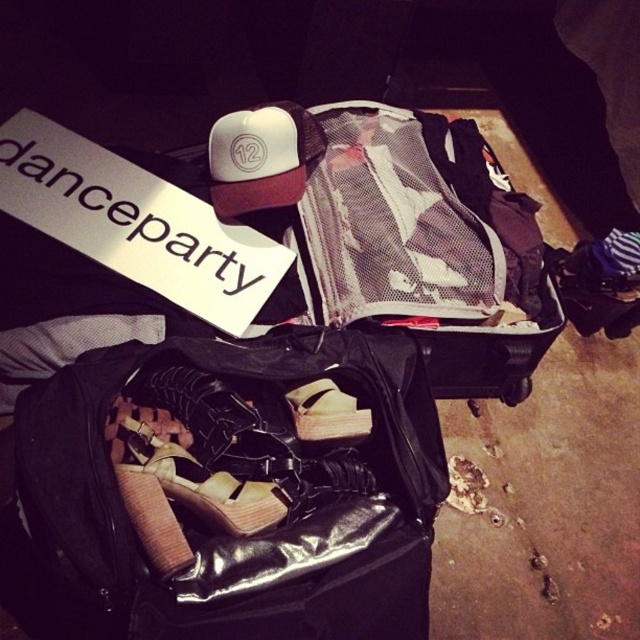
Question: Considering the real-world distances, which object is farthest from the white paper sign at upper left?

Choices:
 (A) matte black suitcase at center
 (B) black shiny fabric suitcase at lower left

Answer: (B)

Question: Does black shiny fabric suitcase at lower left appear on the right side of brown leather shoe at center?

Choices:
 (A) no
 (B) yes

Answer: (A)

Question: Is matte black suitcase at center thinner than brown leather shoe at center?

Choices:
 (A) no
 (B) yes

Answer: (A)

Question: Considering the real-world distances, which object is farthest from the black shiny fabric suitcase at lower left?

Choices:
 (A) white paper sign at upper left
 (B) matte black suitcase at center

Answer: (B)

Question: Does black shiny fabric suitcase at lower left lie behind matte black suitcase at center?

Choices:
 (A) no
 (B) yes

Answer: (A)

Question: Which of the following is the closest to the observer?

Choices:
 (A) (288, 452)
 (B) (8, 173)

Answer: (A)